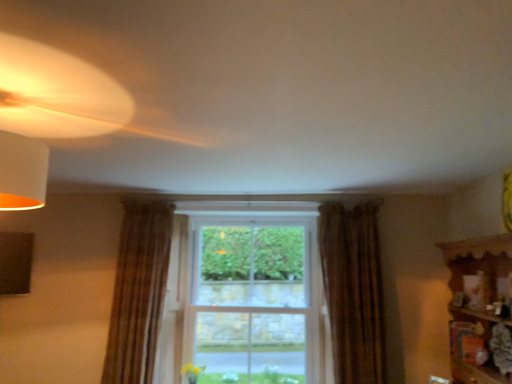
In the scene shown: In order to face wooden shelf at right, should I rotate leftwards or rightwards?

Rotate right and turn 26.788 degrees.

What is the approximate height of wooden shelf at right?

1.00 meters.

Image resolution: width=512 pixels, height=384 pixels. In order to click on brown textured curtain at right, the 1th curtain viewed from the right in this screenshot , I will do `click(353, 291)`.

Are brown textured curtain at left, which ranks as the first curtain in left-to-right order, and brown textured curtain at right, which ranks as the 2th curtain in left-to-right order, beside each other?

No, brown textured curtain at left, which ranks as the first curtain in left-to-right order, is not with brown textured curtain at right, which ranks as the 2th curtain in left-to-right order.

Is brown textured curtain at left, which appears as the second curtain when viewed from the right, thinner than brown textured curtain at right, the 1th curtain viewed from the right?

Yes.

Is point (144, 210) behind point (382, 316)?

Yes, point (144, 210) is behind point (382, 316).

From a real-world perspective, between brown textured curtain at right, which ranks as the 2th curtain in left-to-right order, and clear glass window at center, who is vertically higher?

brown textured curtain at right, which ranks as the 2th curtain in left-to-right order, is physically above.

Relative to clear glass window at center, is brown textured curtain at right, which ranks as the 2th curtain in left-to-right order, in front or behind?

brown textured curtain at right, which ranks as the 2th curtain in left-to-right order, is in front of clear glass window at center.

Identify the location of curtain that is the 2nd object located in front of the clear glass window at center. The height and width of the screenshot is (384, 512). (353, 291).

Considering the relative positions of brown textured curtain at right, the 1th curtain viewed from the right, and clear glass window at center in the image provided, is brown textured curtain at right, the 1th curtain viewed from the right, to the left or to the right of clear glass window at center?

From the image, it's evident that brown textured curtain at right, the 1th curtain viewed from the right, is to the right of clear glass window at center.

Which of these two, wooden shelf at right or brown textured curtain at right, the 1th curtain viewed from the right, is smaller?

→ brown textured curtain at right, the 1th curtain viewed from the right, is smaller.

How different are the orientations of wooden shelf at right and brown textured curtain at right, which ranks as the 2th curtain in left-to-right order, in degrees?

The facing directions of wooden shelf at right and brown textured curtain at right, which ranks as the 2th curtain in left-to-right order, are 85.9 degrees apart.

Identify the location of shelf on the right of brown textured curtain at right, the 1th curtain viewed from the right. (480, 309).

Is brown textured curtain at right, the 1th curtain viewed from the right, far away from brown textured curtain at left, which appears as the second curtain when viewed from the right?

brown textured curtain at right, the 1th curtain viewed from the right, is far away from brown textured curtain at left, which appears as the second curtain when viewed from the right.

The width and height of the screenshot is (512, 384). Identify the location of curtain on the right of brown textured curtain at left, which ranks as the first curtain in left-to-right order. (353, 291).

Is brown textured curtain at right, which ranks as the 2th curtain in left-to-right order, spatially inside brown textured curtain at left, which ranks as the first curtain in left-to-right order, or outside of it?

brown textured curtain at right, which ranks as the 2th curtain in left-to-right order, lies outside brown textured curtain at left, which ranks as the first curtain in left-to-right order.

Considering the relative positions of brown textured curtain at right, the 1th curtain viewed from the right, and brown textured curtain at left, which appears as the second curtain when viewed from the right, in the image provided, is brown textured curtain at right, the 1th curtain viewed from the right, in front of brown textured curtain at left, which appears as the second curtain when viewed from the right,?

Yes, it is in front of brown textured curtain at left, which appears as the second curtain when viewed from the right.

Could brown textured curtain at left, which ranks as the first curtain in left-to-right order, be considered to be inside wooden shelf at right?

Actually, brown textured curtain at left, which ranks as the first curtain in left-to-right order, is outside wooden shelf at right.

Based on the photo, measure the distance between wooden shelf at right and brown textured curtain at left, which appears as the second curtain when viewed from the right.

The distance of wooden shelf at right from brown textured curtain at left, which appears as the second curtain when viewed from the right, is 7.59 feet.

Is wooden shelf at right turned away from brown textured curtain at left, which ranks as the first curtain in left-to-right order?

No.

In the scene shown: Which of these two, wooden shelf at right or brown textured curtain at left, which appears as the second curtain when viewed from the right, stands taller?

Standing taller between the two is brown textured curtain at left, which appears as the second curtain when viewed from the right.

Is brown textured curtain at left, which ranks as the first curtain in left-to-right order, directly adjacent to clear glass window at center?

No, brown textured curtain at left, which ranks as the first curtain in left-to-right order, is not with clear glass window at center.

Is clear glass window at center completely or partially inside brown textured curtain at left, which ranks as the first curtain in left-to-right order?

No, clear glass window at center is not a part of brown textured curtain at left, which ranks as the first curtain in left-to-right order.

How distant is brown textured curtain at left, which ranks as the first curtain in left-to-right order, from clear glass window at center?

A distance of 1.53 meters exists between brown textured curtain at left, which ranks as the first curtain in left-to-right order, and clear glass window at center.

Would you say brown textured curtain at left, which ranks as the first curtain in left-to-right order, is to the left or to the right of clear glass window at center in the picture?

Clearly, brown textured curtain at left, which ranks as the first curtain in left-to-right order, is on the left of clear glass window at center in the image.

Who is smaller, clear glass window at center or brown textured curtain at left, which ranks as the first curtain in left-to-right order?

brown textured curtain at left, which ranks as the first curtain in left-to-right order.

Considering the sizes of objects clear glass window at center and brown textured curtain at left, which appears as the second curtain when viewed from the right, in the image provided, who is shorter, clear glass window at center or brown textured curtain at left, which appears as the second curtain when viewed from the right,?

brown textured curtain at left, which appears as the second curtain when viewed from the right.

Is clear glass window at center further to the viewer compared to brown textured curtain at left, which ranks as the first curtain in left-to-right order?

Yes.

Where is `curtain that appears below the brown textured curtain at right, which ranks as the 2th curtain in left-to-right order (from the image's perspective)`? The image size is (512, 384). curtain that appears below the brown textured curtain at right, which ranks as the 2th curtain in left-to-right order (from the image's perspective) is located at coordinates (138, 292).

You are a GUI agent. You are given a task and a screenshot of the screen. Output one action in this format:
    pyautogui.click(x=<x>, y=<y>)
    Task: Click on the curtain that appears on the right of clear glass window at center
    The height and width of the screenshot is (384, 512).
    Given the screenshot: What is the action you would take?
    pyautogui.click(x=353, y=291)

When comparing their distances from wooden shelf at right, does brown textured curtain at right, the 1th curtain viewed from the right, or brown textured curtain at left, which appears as the second curtain when viewed from the right, seem closer?

Based on the image, brown textured curtain at right, the 1th curtain viewed from the right, appears to be nearer to wooden shelf at right.

Based on their spatial positions, is clear glass window at center or brown textured curtain at right, the 1th curtain viewed from the right, further from brown textured curtain at left, which appears as the second curtain when viewed from the right?

clear glass window at center is further to brown textured curtain at left, which appears as the second curtain when viewed from the right.

Considering their positions, is brown textured curtain at left, which appears as the second curtain when viewed from the right, positioned further to brown textured curtain at right, which ranks as the 2th curtain in left-to-right order, than clear glass window at center?

clear glass window at center.

Considering their positions, is wooden shelf at right positioned closer to brown textured curtain at left, which ranks as the first curtain in left-to-right order, than brown textured curtain at right, which ranks as the 2th curtain in left-to-right order?

brown textured curtain at right, which ranks as the 2th curtain in left-to-right order, is positioned closer to the anchor brown textured curtain at left, which ranks as the first curtain in left-to-right order.

When comparing their distances from brown textured curtain at left, which appears as the second curtain when viewed from the right, does clear glass window at center or wooden shelf at right seem further?

Among the two, wooden shelf at right is located further to brown textured curtain at left, which appears as the second curtain when viewed from the right.

Which object lies nearer to the anchor point clear glass window at center, brown textured curtain at right, which ranks as the 2th curtain in left-to-right order, or wooden shelf at right?

Based on the image, brown textured curtain at right, which ranks as the 2th curtain in left-to-right order, appears to be nearer to clear glass window at center.

Based on their spatial positions, is clear glass window at center or brown textured curtain at left, which ranks as the first curtain in left-to-right order, closer to wooden shelf at right?

clear glass window at center.

When comparing their distances from clear glass window at center, does wooden shelf at right or brown textured curtain at left, which ranks as the first curtain in left-to-right order, seem closer?

The object closer to clear glass window at center is brown textured curtain at left, which ranks as the first curtain in left-to-right order.

Where is `bay window located between brown textured curtain at left, which appears as the second curtain when viewed from the right, and brown textured curtain at right, which ranks as the 2th curtain in left-to-right order, in the left-right direction`? This screenshot has height=384, width=512. bay window located between brown textured curtain at left, which appears as the second curtain when viewed from the right, and brown textured curtain at right, which ranks as the 2th curtain in left-to-right order, in the left-right direction is located at coordinates (252, 300).

The height and width of the screenshot is (384, 512). In order to click on bay window located between brown textured curtain at left, which appears as the second curtain when viewed from the right, and wooden shelf at right in the left-right direction in this screenshot , I will do `click(252, 300)`.

Identify the location of curtain between brown textured curtain at left, which ranks as the first curtain in left-to-right order, and wooden shelf at right from left to right. The image size is (512, 384). (353, 291).